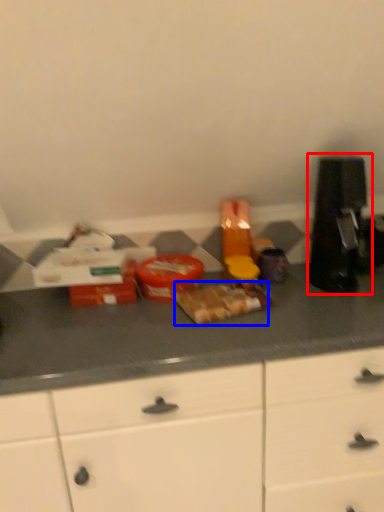
Question: Among these objects, which one is nearest to the camera, coffee machine (highlighted by a red box) or food (highlighted by a blue box)?

Choices:
 (A) coffee machine
 (B) food

Answer: (B)